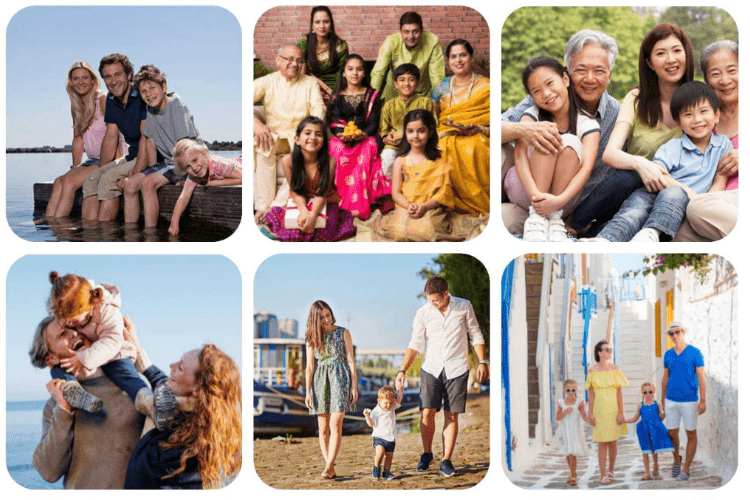
The width and height of the screenshot is (750, 500). Identify the location of photo blocks. (178, 58), (158, 311), (372, 293), (453, 20), (627, 25), (630, 312).